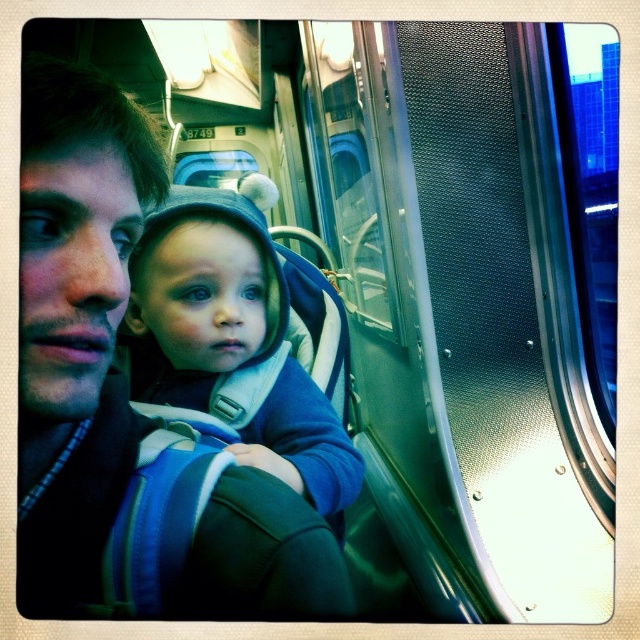
Please provide the 2D coordinates of the matte black jacket at left in the image. The coordinates should be in the format of a point with two decimal places, such as point x, y.

The 2D coordinates of the matte black jacket at left are point (125,401).

You are a passenger on a train and you want to know which of the two jackets is smaller. You see the matte black jacket at left and the blue fleece jacket at center. Which one is smaller?

The matte black jacket at left is smaller than the blue fleece jacket at center according to the description provided.